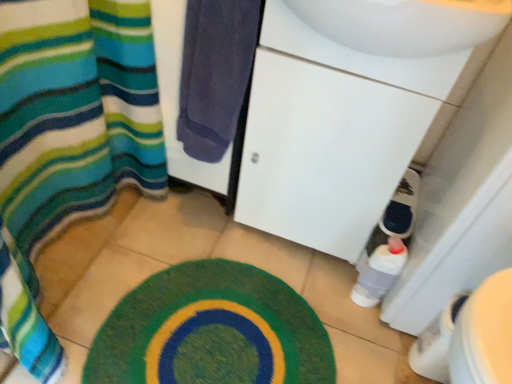
Question: Choose the correct answer: Is green fuzzy bath mat at lower center inside white glossy sink at center or outside it?

Choices:
 (A) inside
 (B) outside

Answer: (B)

Question: Is point [232, 326] closer or farther from the camera than point [352, 127]?

Choices:
 (A) closer
 (B) farther

Answer: (B)

Question: Which of these objects is positioned closest to the white glossy sink at center?

Choices:
 (A) green fuzzy bath mat at lower center
 (B) translucent plastic bottle at lower right
 (C) dark blue towel at center
 (D) striped fabric shower curtain at left

Answer: (C)

Question: Considering the real-world distances, which object is farthest from the translucent plastic bottle at lower right?

Choices:
 (A) white glossy sink at center
 (B) dark blue towel at center
 (C) green fuzzy bath mat at lower center
 (D) striped fabric shower curtain at left

Answer: (D)